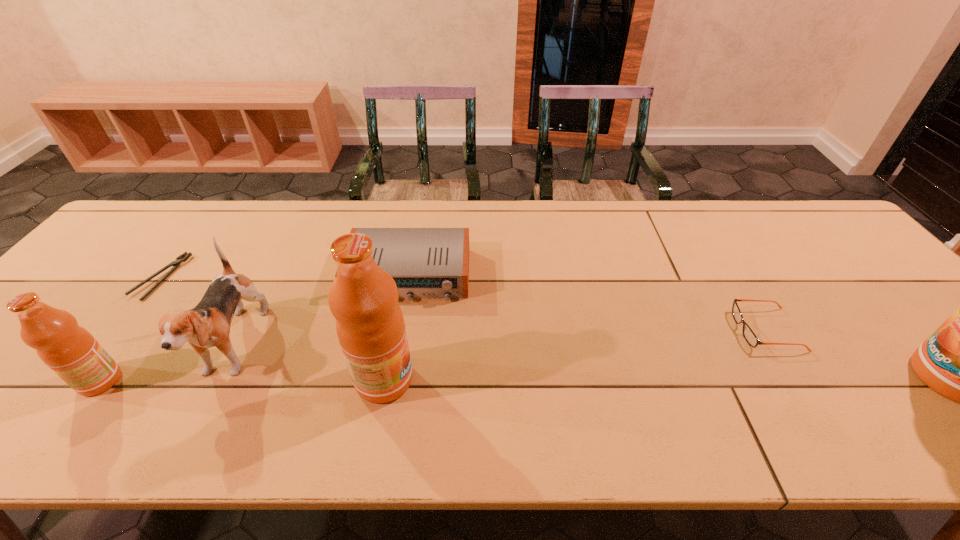
Locate an element on the screen. vacant region at the left edge is located at coordinates (101, 275).

This screenshot has width=960, height=540. Identify the location of free location at the right edge of the desktop. tap(843, 291).

The image size is (960, 540). In the image, there is a desktop. Identify the location of blank space at the far left corner. (175, 215).

Locate an element on the screen. free space at the near left corner of the desktop is located at coordinates (8, 399).

Identify the location of vacant area that lies between the third shortest object and the leftmost fruit juice. (254, 328).

At what (x,y) coordinates should I click in order to perform the action: click on free space between the second tallest object and the tongs. Please return your answer as a coordinate pair (x, y). The height and width of the screenshot is (540, 960). Looking at the image, I should click on (273, 328).

At what (x,y) coordinates should I click in order to perform the action: click on blank region between the leftmost fruit juice and the shortest object. Please return your answer as a coordinate pair (x, y). Looking at the image, I should click on (131, 329).

The height and width of the screenshot is (540, 960). In order to click on empty space that is in between the spectacles and the puppy in this screenshot , I will do `click(500, 340)`.

The image size is (960, 540). I want to click on free space that is in between the shortest fruit juice and the puppy, so click(167, 365).

The height and width of the screenshot is (540, 960). Identify the location of object that is the second closest to the shortest fruit juice. (185, 256).